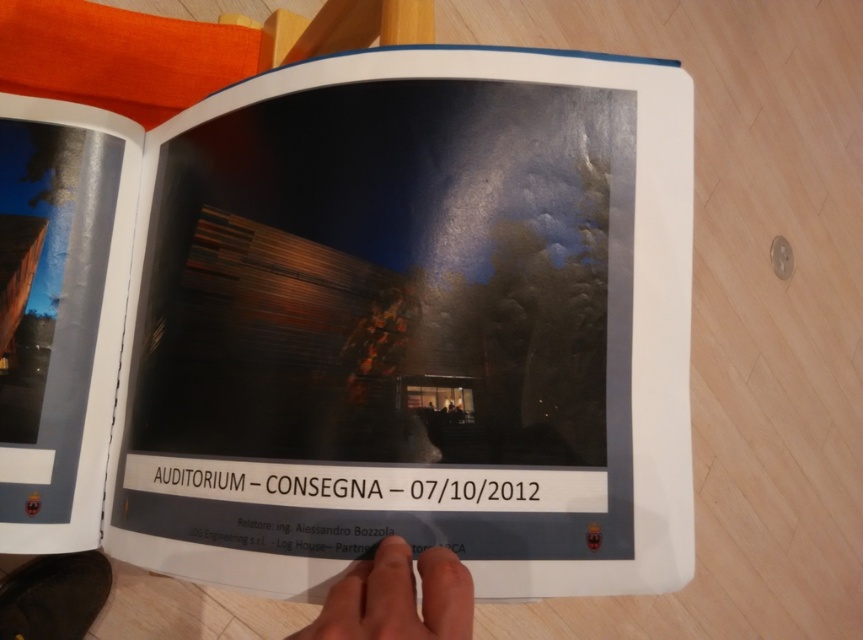
Question: Which object is farther from the camera taking this photo?

Choices:
 (A) matte paper book at center
 (B) skin-toned hand at lower center
 (C) matte skin hand at lower center

Answer: (B)

Question: Estimate the real-world distances between objects in this image. Which object is closer to the matte skin hand at lower center?

Choices:
 (A) matte paper book at center
 (B) skin-toned hand at lower center

Answer: (A)

Question: Which is farther from the skin-toned hand at lower center?

Choices:
 (A) matte paper book at center
 (B) matte skin hand at lower center

Answer: (B)

Question: Is matte paper book at center further to the viewer compared to matte skin hand at lower center?

Choices:
 (A) yes
 (B) no

Answer: (A)

Question: Is matte paper book at center to the left of skin-toned hand at lower center from the viewer's perspective?

Choices:
 (A) yes
 (B) no

Answer: (B)

Question: Can you confirm if matte paper book at center is thinner than matte skin hand at lower center?

Choices:
 (A) yes
 (B) no

Answer: (B)